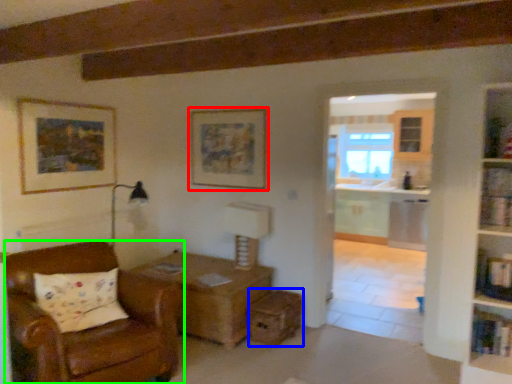
Question: Which object is positioned farthest from picture frame (highlighted by a red box)? Select from drawer (highlighted by a blue box) and chair (highlighted by a green box).

Choices:
 (A) drawer
 (B) chair

Answer: (B)